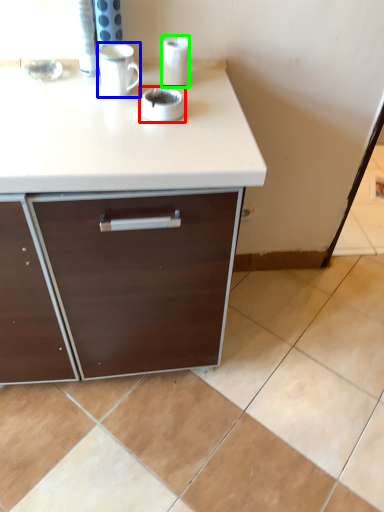
Question: Based on their relative distances, which object is farther from appliance (highlighted by a red box)? Choose from mug (highlighted by a blue box) and paper towel (highlighted by a green box).

Choices:
 (A) mug
 (B) paper towel

Answer: (B)